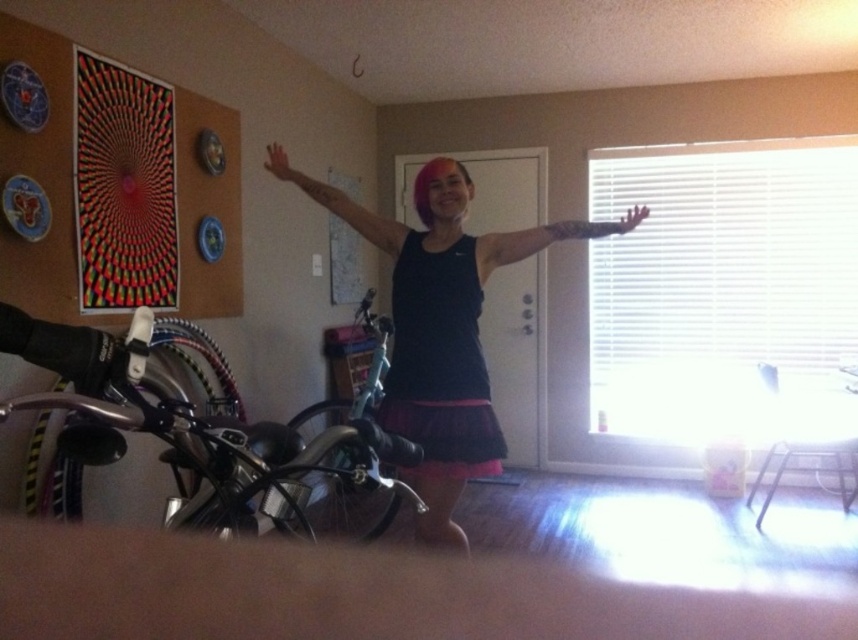
You are planning to move the shiny black bicycle at left into a space that can only accommodate items narrower than the tattooed skin at center. Based on the scene description, will the bicycle fit?

The shiny black bicycle at left is wider than the tattooed skin at center, so it will not fit in the space that can only accommodate items narrower than the tattooed skin at center.

You are standing in the room and want to place a small decoration between the two points, point (188,413) and point (521,230). Which point should you start placing the decoration closer to to ensure it is nearer to the viewer?

You should start placing the decoration closer to point (188,413) because it is nearer to the viewer than point (521,230).